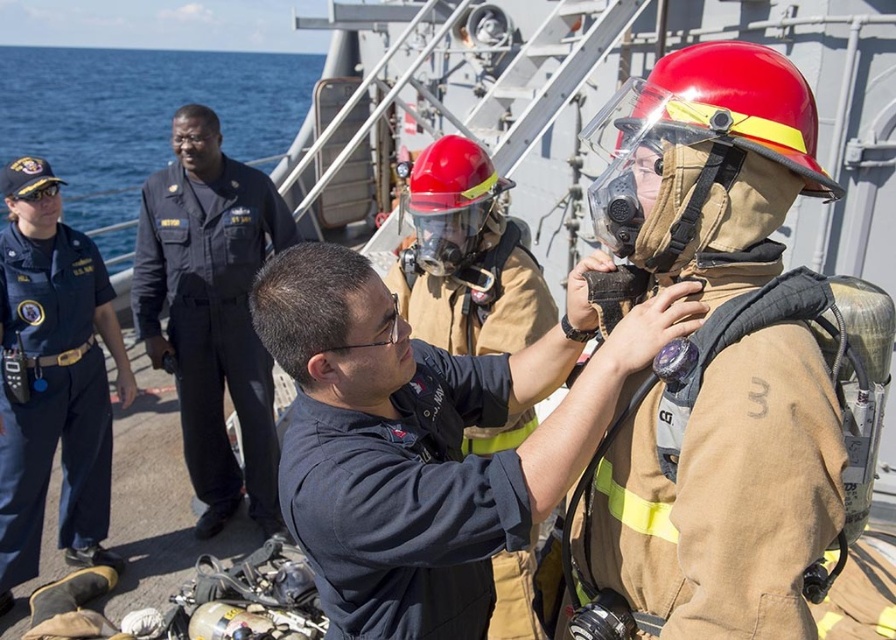
Between point (247, 381) and point (501, 250), which one is positioned behind?

Point (247, 381)

Does dark blue uniform at left appear on the left side of brown/cotton fire suit at center?

Yes, dark blue uniform at left is to the left of brown/cotton fire suit at center.

Find the location of a particular element. Image resolution: width=896 pixels, height=640 pixels. dark blue uniform at left is located at coordinates (211, 312).

Which is in front, point (454, 374) or point (54, 438)?

Point (454, 374)

Who is more distant from viewer, (454, 531) or (112, 289)?

Point (112, 289)

From the picture: Who is more distant from viewer, (350, 472) or (67, 452)?

The point (67, 452) is behind.

The height and width of the screenshot is (640, 896). I want to click on dark blue fabric shirt at center, so click(x=411, y=506).

Can you confirm if dark blue uniform at center is thinner than brown/cotton fire suit at center?

No, dark blue uniform at center is not thinner than brown/cotton fire suit at center.

Can you confirm if dark blue uniform at center is positioned to the left of brown/cotton fire suit at center?

Correct, you'll find dark blue uniform at center to the left of brown/cotton fire suit at center.

Based on the photo, who is more forward, (481, 419) or (498, 611)?

Positioned in front is point (481, 419).

Locate an element on the screen. The width and height of the screenshot is (896, 640). dark blue uniform at center is located at coordinates (423, 442).